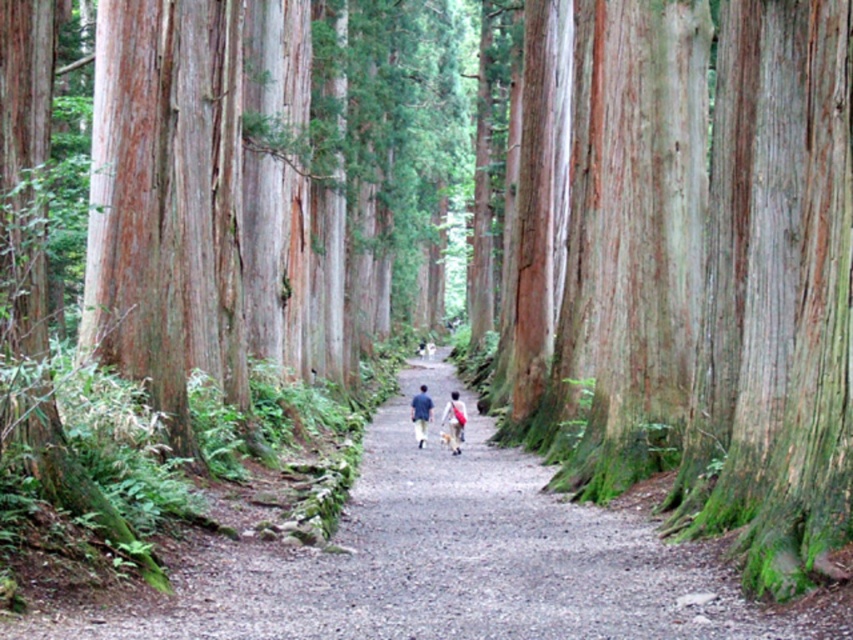
Question: In this image, where is dirt path at center located relative to blue fabric person at center?

Choices:
 (A) above
 (B) below

Answer: (B)

Question: Considering the real-world distances, which object is farthest from the light blue fabric at center?

Choices:
 (A) blue fabric person at center
 (B) dirt path at center

Answer: (B)

Question: Which point is closer to the camera?

Choices:
 (A) (421, 385)
 (B) (456, 451)

Answer: (B)

Question: Which object is farther from the camera taking this photo?

Choices:
 (A) dirt path at center
 (B) light blue fabric at center

Answer: (B)

Question: Can you confirm if light blue fabric at center is positioned above blue fabric person at center?

Choices:
 (A) no
 (B) yes

Answer: (B)

Question: Can you confirm if dirt path at center is positioned to the right of blue fabric person at center?

Choices:
 (A) no
 (B) yes

Answer: (B)